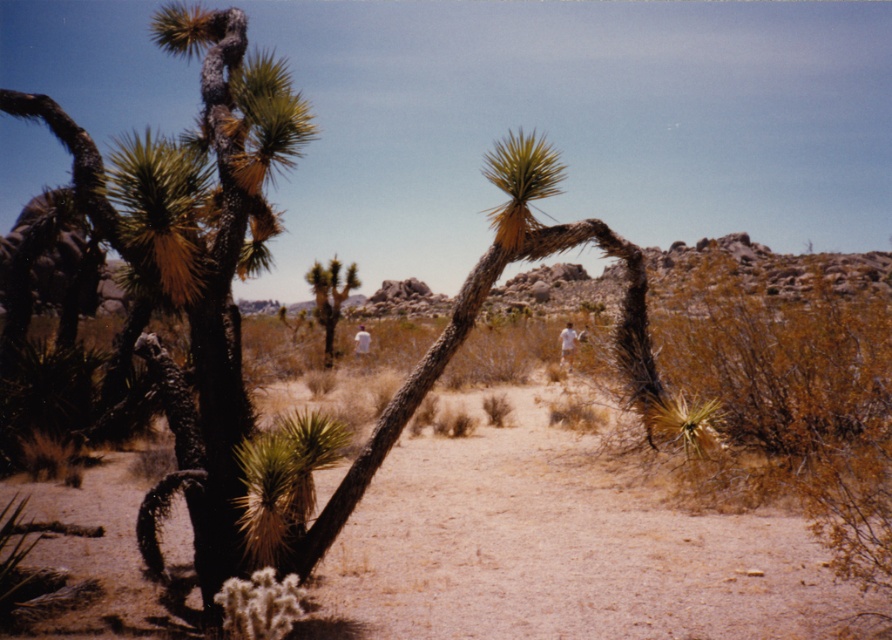
Does brown sandy ground at center appear under green spiky cactus at center?

Yes.

Identify the location of brown sandy ground at center. This screenshot has width=892, height=640. (562, 550).